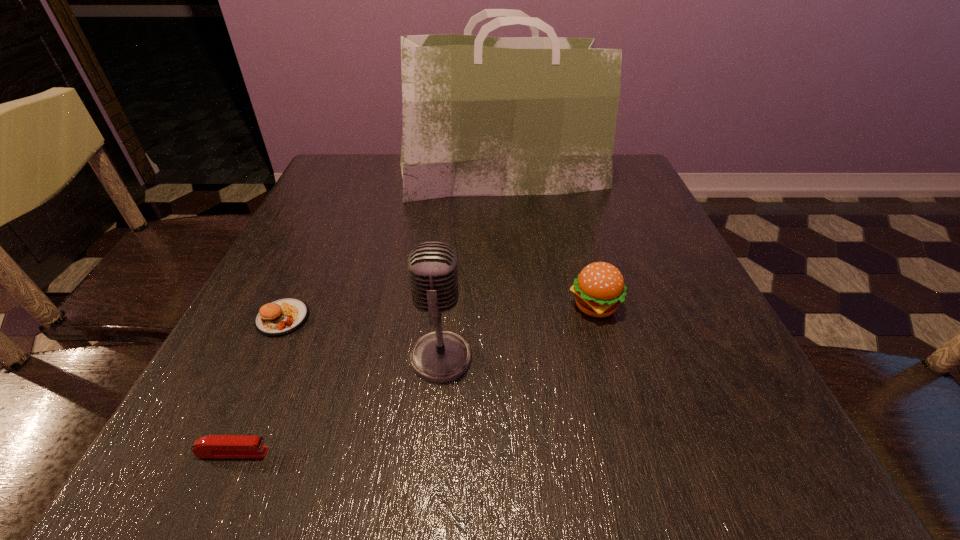
This screenshot has height=540, width=960. I want to click on the tallest object, so click(482, 116).

The width and height of the screenshot is (960, 540). Find the location of `grocery bag`. grocery bag is located at coordinates (482, 116).

This screenshot has height=540, width=960. What are the coordinates of `microphone` in the screenshot? It's located at (441, 356).

Identify the location of the third shortest object. (599, 288).

I want to click on patty, so tap(280, 317).

The width and height of the screenshot is (960, 540). What are the coordinates of `the shortest object` in the screenshot? It's located at (212, 446).

You are a GUI agent. You are given a task and a screenshot of the screen. Output one action in this format:
    pyautogui.click(x=<x>, y=<y>)
    Task: Click on the nearest object
    
    Given the screenshot: What is the action you would take?
    pyautogui.click(x=212, y=446)

Locate an element on the screen. This screenshot has width=960, height=540. vacant space positioned on the front of the grocery bag is located at coordinates (508, 258).

Where is `free space located 0.210m on the right of the second tallest object`? The height and width of the screenshot is (540, 960). free space located 0.210m on the right of the second tallest object is located at coordinates (608, 357).

At what (x,y) coordinates should I click in order to perform the action: click on free region located 0.330m on the back of the hamburger. Please return your answer as a coordinate pair (x, y). Looking at the image, I should click on (564, 195).